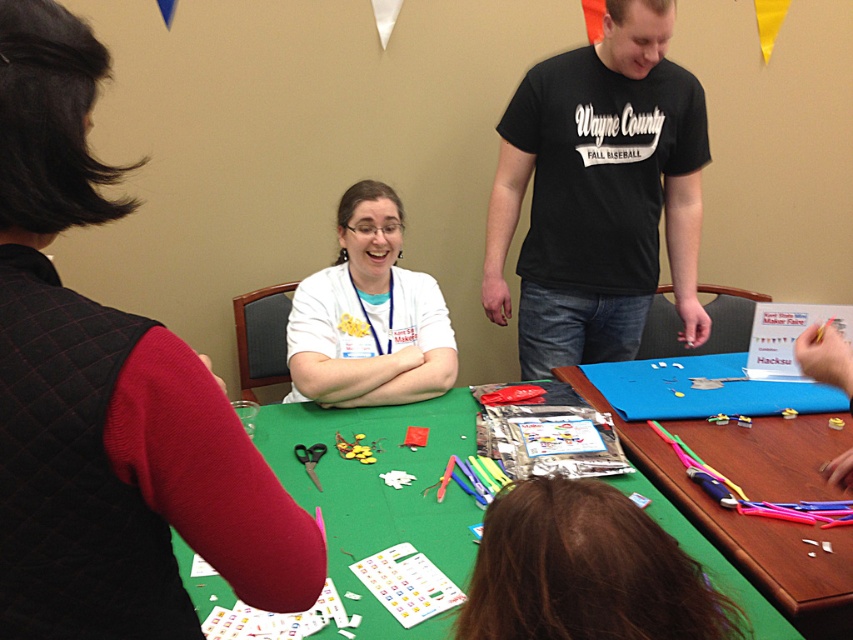
Does point (693, 289) come farther from viewer compared to point (729, 452)?

Yes, point (693, 289) is behind point (729, 452).

Does black cotton t-shirt at upper center appear under green fabric table at lower center?

No.

At what (x,y) coordinates should I click in order to perform the action: click on black cotton t-shirt at upper center. Please return your answer as a coordinate pair (x, y). Image resolution: width=853 pixels, height=640 pixels. Looking at the image, I should click on (599, 193).

Find the location of a particular element. This screenshot has height=640, width=853. black cotton t-shirt at upper center is located at coordinates (599, 193).

Is point (757, 593) farther from camera compared to point (376, 193)?

No, it is in front of (376, 193).

Does point (688, 515) lie in front of point (328, 314)?

Yes, point (688, 515) is in front of point (328, 314).

In order to click on green fabric table at center in this screenshot , I will do `click(380, 493)`.

Which is in front, point (788, 476) or point (380, 240)?

Point (788, 476)

In order to click on green fabric table at lower center in this screenshot , I will do `click(746, 532)`.